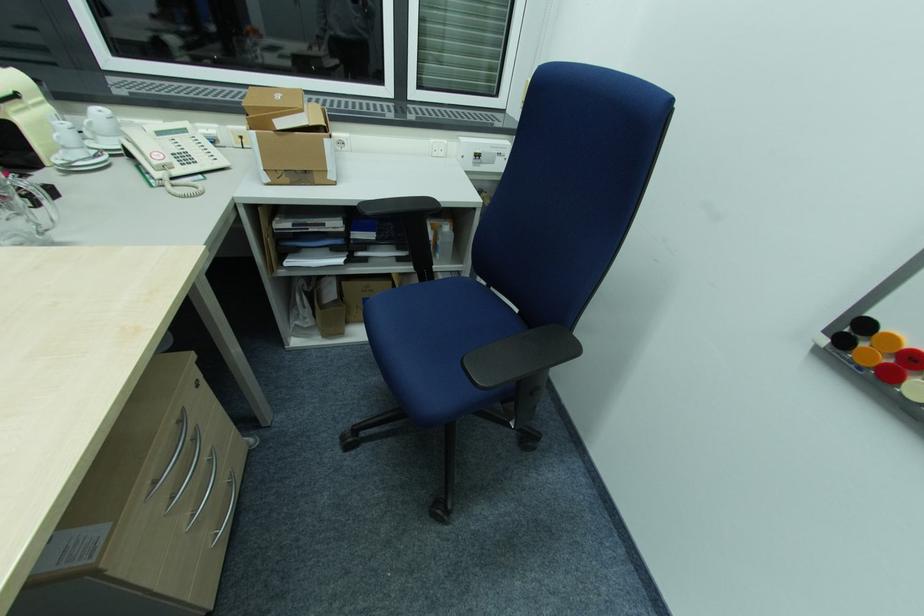
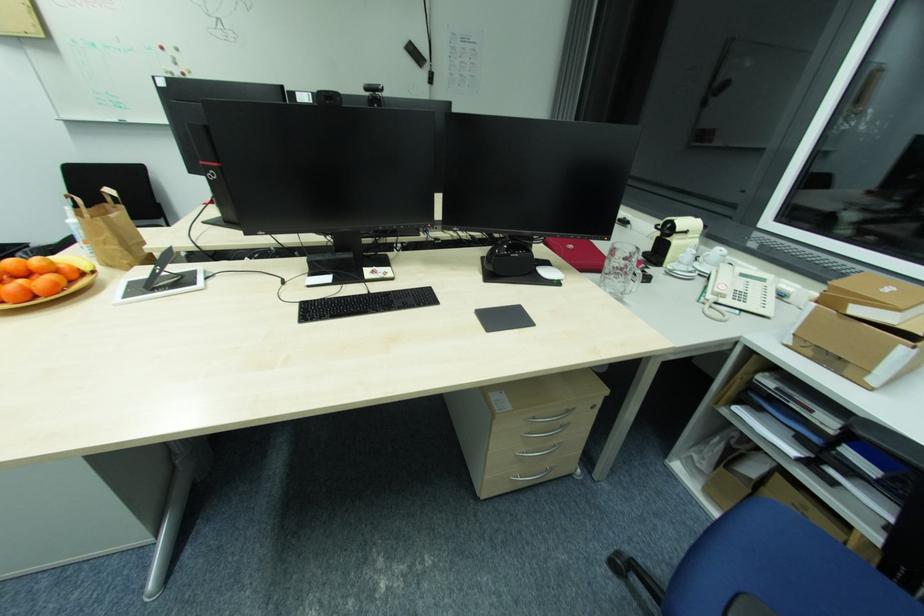
Question: The camera is either moving clockwise (left) or counter-clockwise (right) around the object. The first image is from the beginning of the video and the second image is from the end. Is the camera moving left or right when shooting the video?

Choices:
 (A) Left
 (B) Right

Answer: (B)